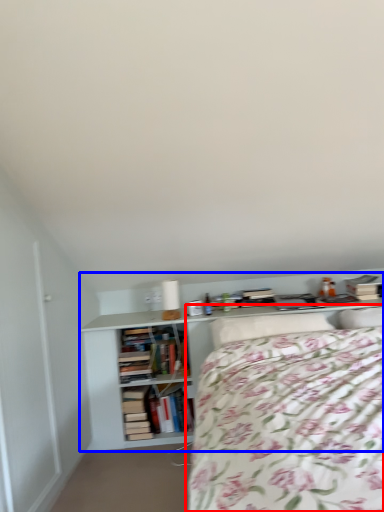
Question: Among these objects, which one is farthest to the camera, bed (highlighted by a red box) or shelf (highlighted by a blue box)?

Choices:
 (A) bed
 (B) shelf

Answer: (B)